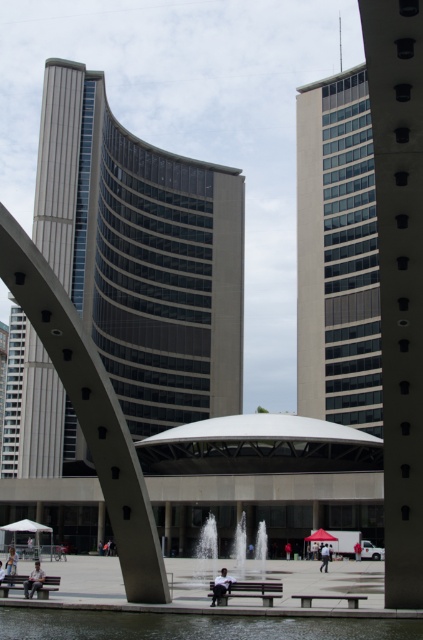
You are a photographer positioned at the edge of the plaza facing the curved building. You want to capture both the matte glass tower at upper right and the smooth concrete tower at right in a single frame. Based on their positions, which tower should you adjust your camera to focus on first to ensure both are in the shot?

The matte glass tower at upper right is to the right of the smooth concrete tower at right. To include both in the frame, focus on the smooth concrete tower at right first, then adjust to include the matte glass tower at upper right which is positioned further to the right.

You are an architect evaluating the modern urban setting. You need to determine which tower has a greater width between the matte glass tower at upper right and the smooth concrete tower at right based on the scene. Which one is wider?

The matte glass tower at upper right is wider than the smooth concrete tower at right according to the description.